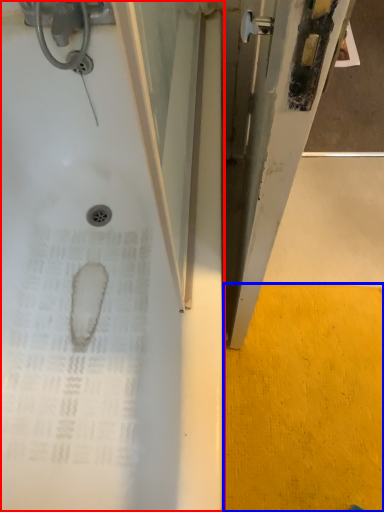
Question: Which object appears farthest to the camera in this image, bathtub (highlighted by a red box) or concrete (highlighted by a blue box)?

Choices:
 (A) bathtub
 (B) concrete

Answer: (B)